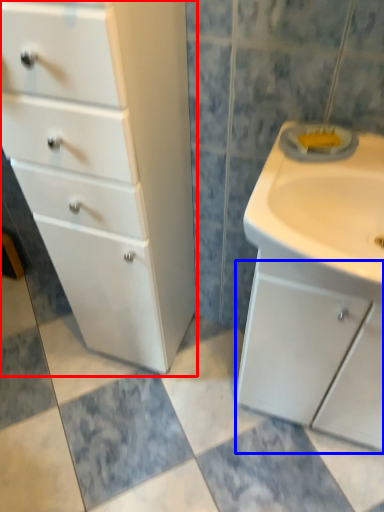
Question: Which object is closer to the camera taking this photo, chest of drawers (highlighted by a red box) or cabinetry (highlighted by a blue box)?

Choices:
 (A) chest of drawers
 (B) cabinetry

Answer: (A)